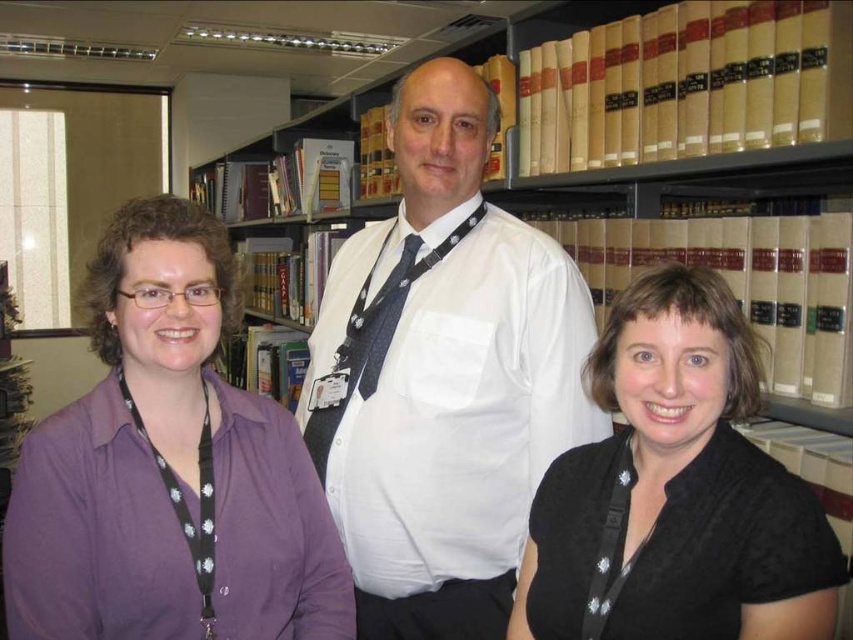
You are a photographer setting up a shot of the three people in the library. You notice the white shirt at center and the dark blue textured tie at center. Which one is in front of the other?

The white shirt at center is closer to the viewer than the dark blue textured tie at center, so the white shirt at center is in front of the dark blue textured tie at center.

You are a photographer trying to capture a group photo of the white shirt at center and dark blue textured tie at center. Which object should you focus on first if you want to ensure both are in focus, considering their positions relative to the camera?

The white shirt at center is wider than dark blue textured tie at center, so focusing on the white shirt at center first would ensure both are in focus as it is the larger object.

You are a photographer setting up a shot in a library. You need to ensure that the white shirt at center and the purple shirt at left are both visible in the frame. Based on their positions, which shirt will appear closer to the camera in the final photo?

The white shirt at center appears closer to the camera because it is positioned over the purple shirt at left, meaning it is in front of the purple shirt.